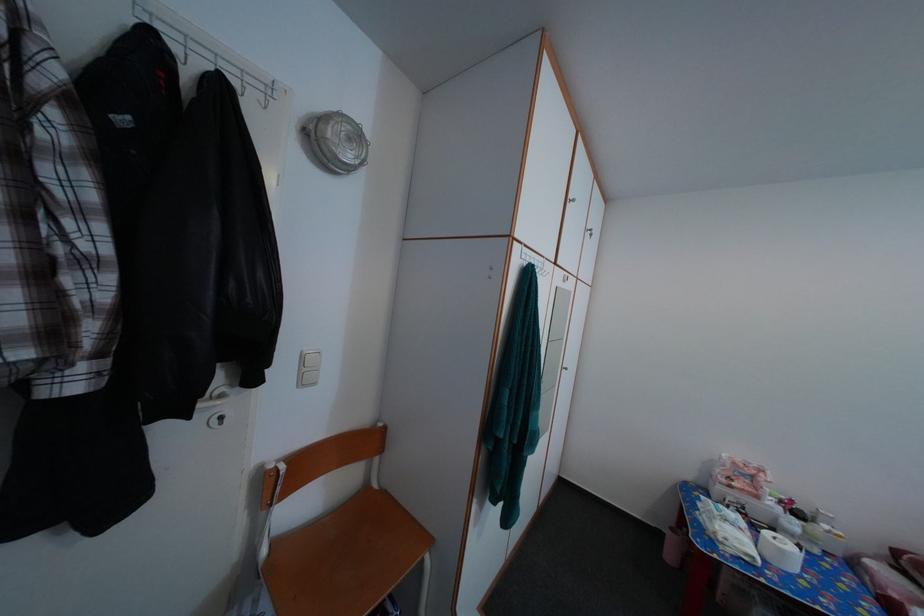
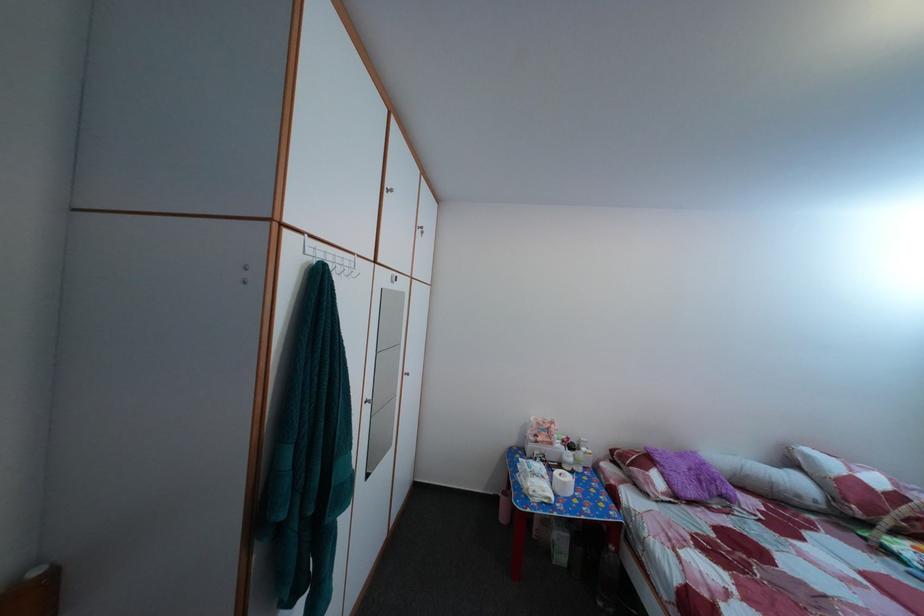
Where in the second image is the point corresponding to (756,523) from the first image?

(555, 469)